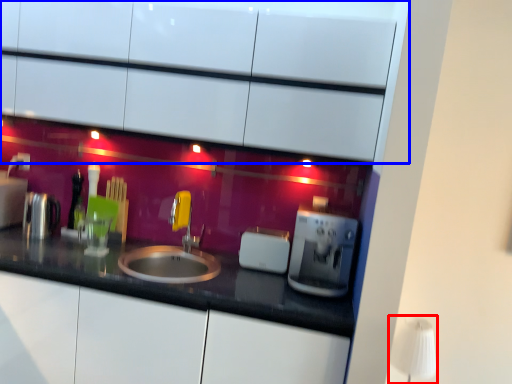
Question: Which point is further to the camera, table lamp (highlighted by a red box) or cabinetry (highlighted by a blue box)?

Choices:
 (A) table lamp
 (B) cabinetry

Answer: (A)